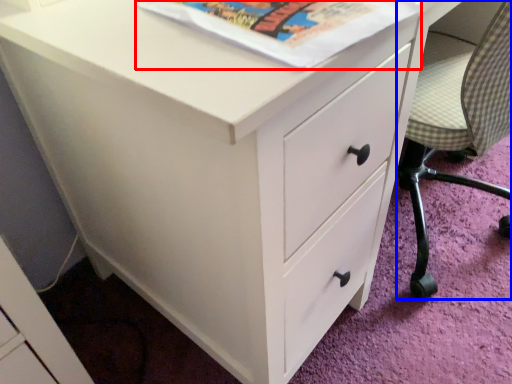
Question: Which object is further to the camera taking this photo, paperback book (highlighted by a red box) or armchair (highlighted by a blue box)?

Choices:
 (A) paperback book
 (B) armchair

Answer: (B)